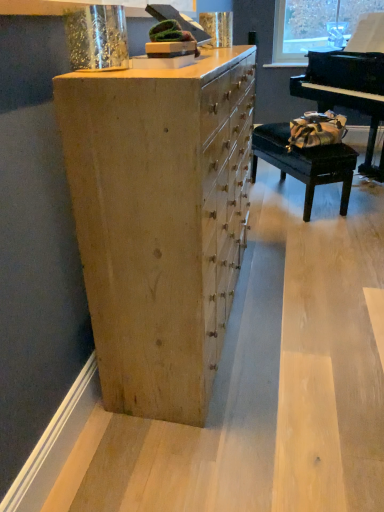
You are a GUI agent. You are given a task and a screenshot of the screen. Output one action in this format:
    pyautogui.click(x=<x>, y=<y>)
    Task: Click on the free location to the right of natural wood chest of drawers at center
    Image resolution: width=384 pixels, height=512 pixels.
    Given the screenshot: What is the action you would take?
    pyautogui.click(x=302, y=294)